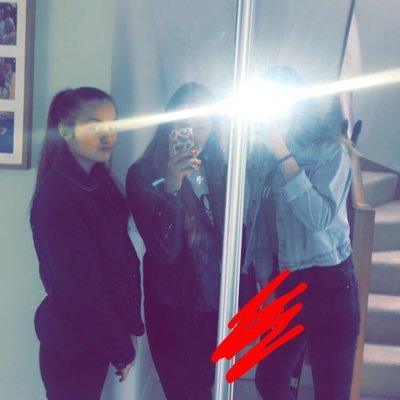
Locate an element on the screen. The width and height of the screenshot is (400, 400). stairway reflection is located at coordinates tap(376, 257).